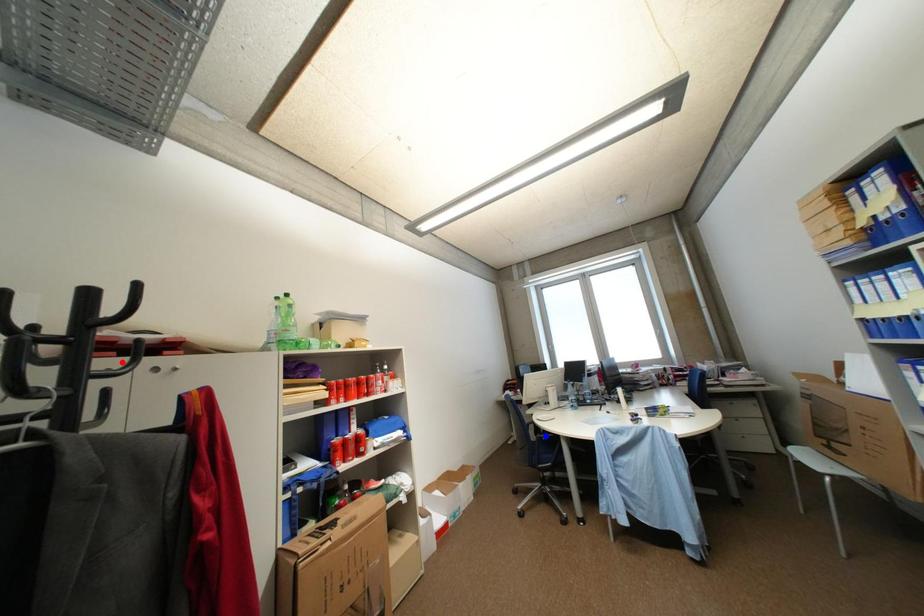
Question: In the image, two points are highlighted. Which point is nearer to the camera? Reply with the corresponding letter.

Choices:
 (A) blue point
 (B) red point

Answer: (B)